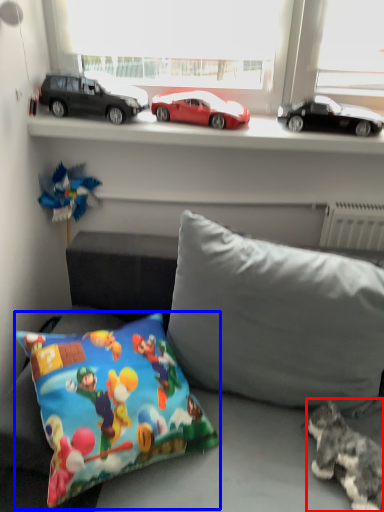
Question: Which object is closer to the camera taking this photo, animal (highlighted by a red box) or pillow (highlighted by a blue box)?

Choices:
 (A) animal
 (B) pillow

Answer: (B)